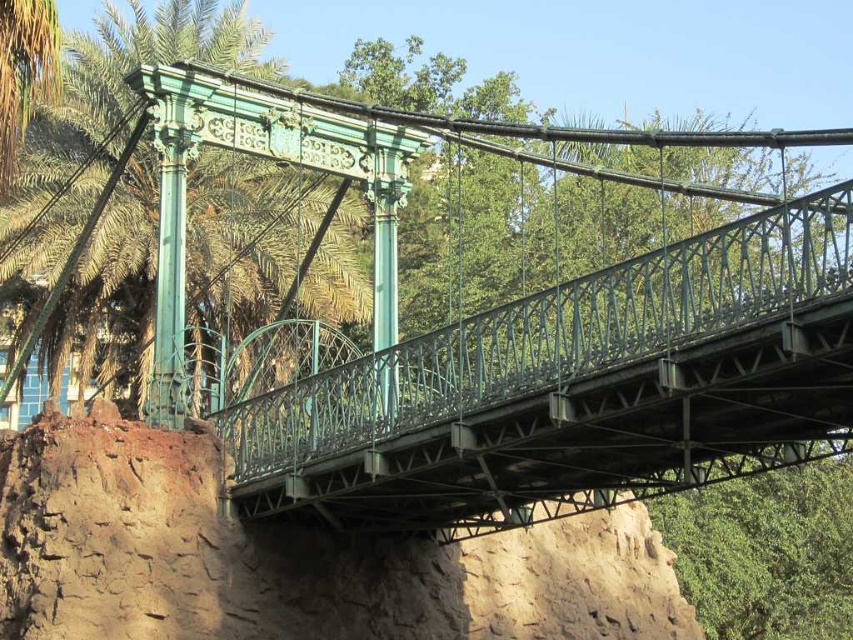
You are a hiker standing on the suspension bridge and looking down. You notice the brown rough cliff at lower center and the green metal palm tree at left. Which object is taller from your viewpoint?

The green metal palm tree at left is taller than the brown rough cliff at lower center.